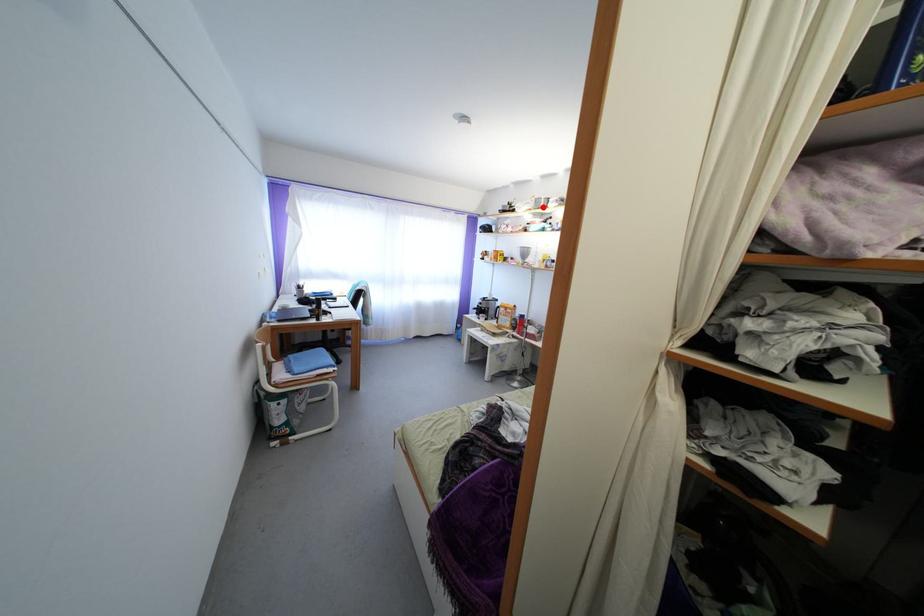
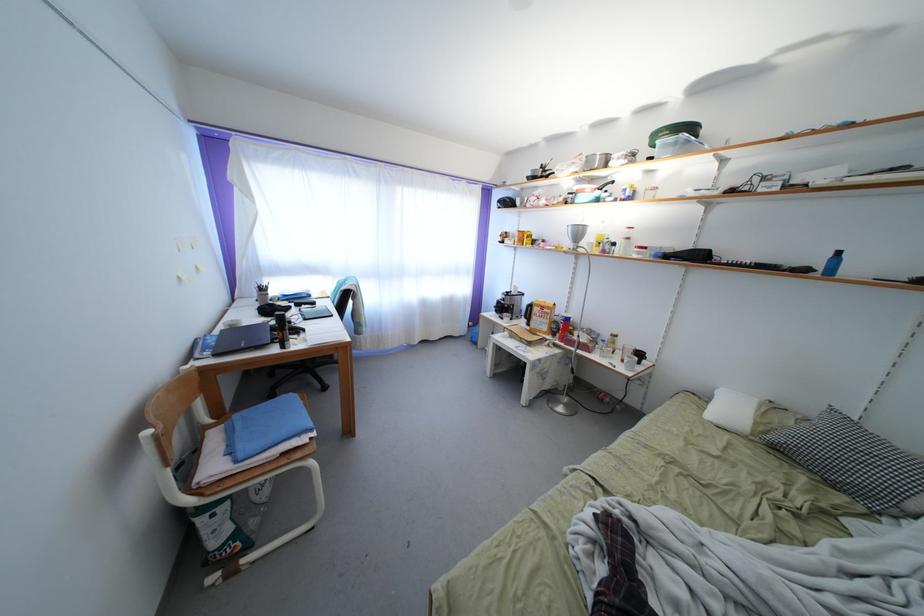
Where in the second image is the point corresponding to the highlighted location from the first image?

(594, 166)